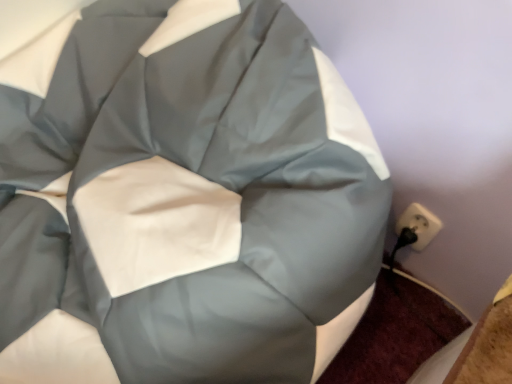
Identify the location of white plastic socket at lower right. (416, 227).

The height and width of the screenshot is (384, 512). What do you see at coordinates (416, 227) in the screenshot? I see `white plastic socket at lower right` at bounding box center [416, 227].

The image size is (512, 384). I want to click on white plastic socket at lower right, so click(416, 227).